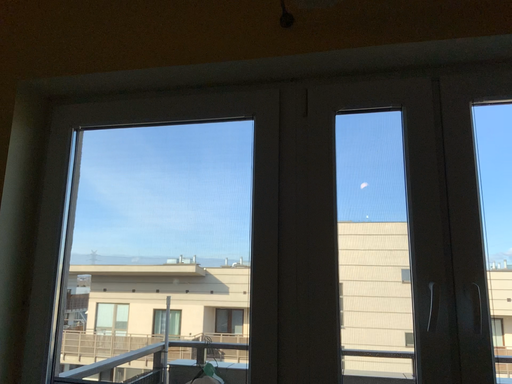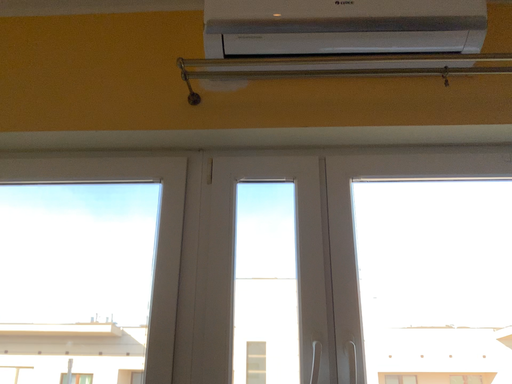
Question: Which way did the camera rotate in the video?

Choices:
 (A) rotated downward
 (B) rotated upward

Answer: (B)